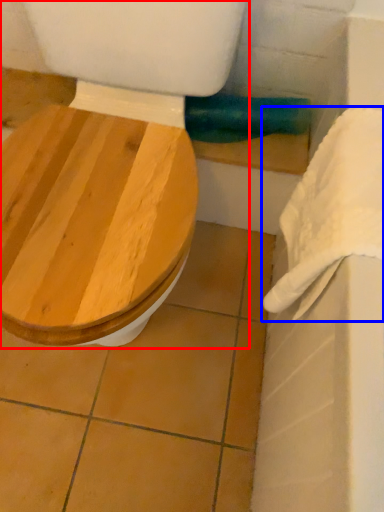
Question: Which object is closer to the camera taking this photo, toilet (highlighted by a red box) or towel/napkin (highlighted by a blue box)?

Choices:
 (A) toilet
 (B) towel/napkin

Answer: (A)